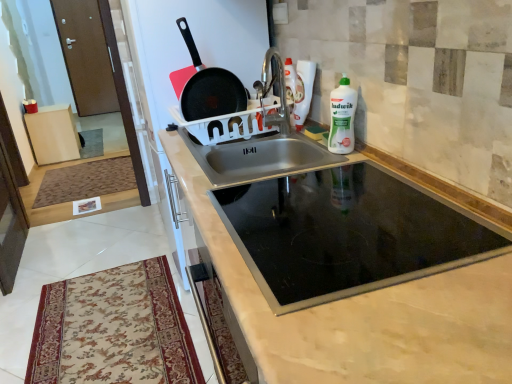
You are a GUI agent. You are given a task and a screenshot of the screen. Output one action in this format:
    pyautogui.click(x=<x>, y=<y>)
    Task: Click on the vacant area on top of beige floral rug at lower left, arranged as the 2th mat when viewed from the back (from a real-world perspective)
    
    Given the screenshot: What is the action you would take?
    pyautogui.click(x=110, y=328)